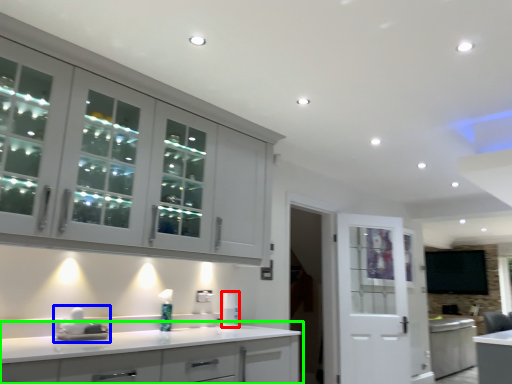
Question: Based on their relative distances, which object is farther from appliance (highlighted by a red box)? Choose from sink (highlighted by a blue box) and cabinetry (highlighted by a green box).

Choices:
 (A) sink
 (B) cabinetry

Answer: (A)